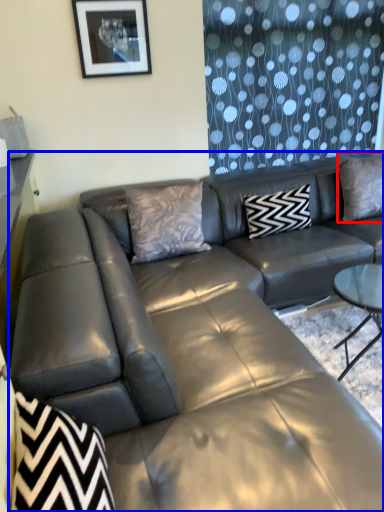
Question: Which of the following is the closest to the observer, pillow (highlighted by a red box) or studio couch (highlighted by a blue box)?

Choices:
 (A) pillow
 (B) studio couch

Answer: (B)